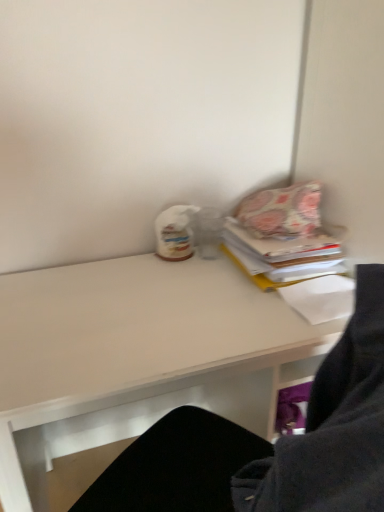
Question: Does white matte desk at center appear on the right side of patterned fabric book at upper right?

Choices:
 (A) yes
 (B) no

Answer: (B)

Question: Is white matte desk at center not close to patterned fabric book at upper right?

Choices:
 (A) yes
 (B) no

Answer: (B)

Question: From a real-world perspective, is white matte desk at center positioned over patterned fabric book at upper right based on gravity?

Choices:
 (A) yes
 (B) no

Answer: (B)

Question: Does white matte desk at center come in front of patterned fabric book at upper right?

Choices:
 (A) no
 (B) yes

Answer: (B)

Question: Considering the relative sizes of white matte desk at center and patterned fabric book at upper right in the image provided, is white matte desk at center thinner than patterned fabric book at upper right?

Choices:
 (A) no
 (B) yes

Answer: (A)

Question: Is patterned fabric book at upper right located within white matte desk at center?

Choices:
 (A) no
 (B) yes

Answer: (A)

Question: From a real-world perspective, is patterned fabric book at upper right positioned over floral fabric pillow at upper right based on gravity?

Choices:
 (A) yes
 (B) no

Answer: (B)

Question: Can you confirm if patterned fabric book at upper right is positioned to the left of floral fabric pillow at upper right?

Choices:
 (A) yes
 (B) no

Answer: (B)

Question: Can you confirm if patterned fabric book at upper right is wider than floral fabric pillow at upper right?

Choices:
 (A) no
 (B) yes

Answer: (B)

Question: From the image's perspective, is patterned fabric book at upper right below floral fabric pillow at upper right?

Choices:
 (A) no
 (B) yes

Answer: (B)

Question: Is the depth of patterned fabric book at upper right less than that of floral fabric pillow at upper right?

Choices:
 (A) no
 (B) yes

Answer: (B)

Question: From the image's perspective, is patterned fabric book at upper right above floral fabric pillow at upper right?

Choices:
 (A) yes
 (B) no

Answer: (B)

Question: From the image's perspective, would you say white matte desk at center is positioned over floral fabric pillow at upper right?

Choices:
 (A) yes
 (B) no

Answer: (B)